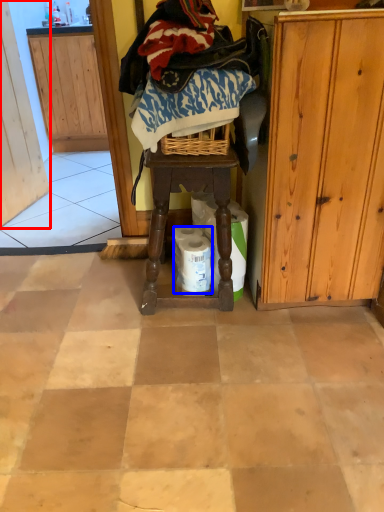
Question: Which object appears farthest to the camera in this image, screen door (highlighted by a red box) or toilet paper (highlighted by a blue box)?

Choices:
 (A) screen door
 (B) toilet paper

Answer: (A)